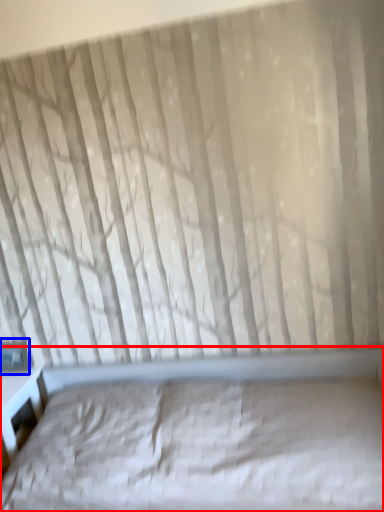
Question: Which object appears closest to the camera in this image, bed (highlighted by a red box) or window (highlighted by a blue box)?

Choices:
 (A) bed
 (B) window

Answer: (A)